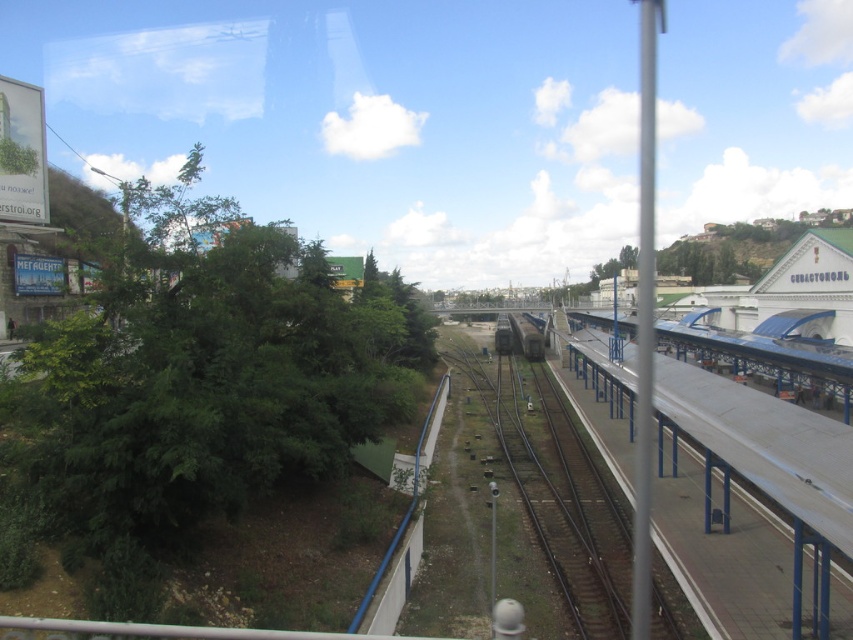
Which is more to the right, green leafy tree at left or metallic gray train at center?

Positioned to the right is metallic gray train at center.

Is green leafy tree at left positioned behind metallic gray train at center?

No, green leafy tree at left is in front of metallic gray train at center.

Who is more distant from viewer, [113,493] or [526,323]?

The point [526,323] is behind.

Where is `green leafy tree at left`? The image size is (853, 640). green leafy tree at left is located at coordinates (210, 374).